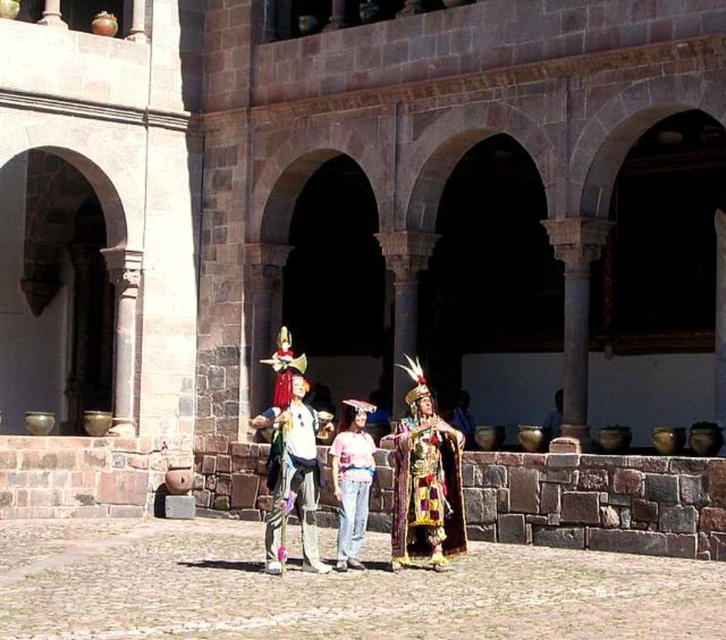
Does smooth stone courtyard at center appear over matte white shirt at center?

No, smooth stone courtyard at center is not above matte white shirt at center.

Who is more distant from viewer, (x=83, y=550) or (x=280, y=508)?

Point (x=83, y=550)

Where is `smooth stone courtyard at center`? The width and height of the screenshot is (726, 640). smooth stone courtyard at center is located at coordinates (333, 589).

Between shiny gold fabric at center and pink fabric costume at center, which one has less height?

With less height is shiny gold fabric at center.

Does point (401, 509) come in front of point (371, 448)?

Yes, point (401, 509) is in front of point (371, 448).

Between point (412, 428) and point (358, 500), which one is positioned in front?

Point (358, 500) is more forward.

What are the coordinates of `shiny gold fabric at center` in the screenshot? It's located at (425, 490).

Which is below, matte white shirt at center or pink fabric costume at center?

Positioned lower is pink fabric costume at center.

Between point (277, 499) and point (367, 488), which one is positioned in front?

Point (277, 499) is in front.

Who is more forward, (309, 538) or (367, 515)?

Point (309, 538) is more forward.

Identify the location of matte white shirt at center. (293, 474).